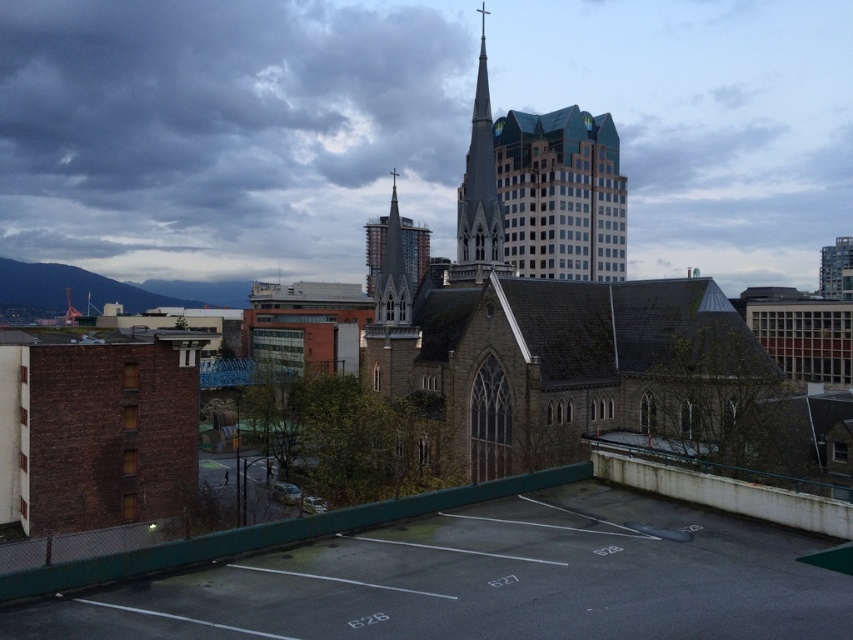
Question: Can you confirm if brown stone church at center is thinner than dark gray stone tower at center?

Choices:
 (A) yes
 (B) no

Answer: (B)

Question: Estimate the real-world distances between objects in this image. Which object is farther from the brown stone church at center?

Choices:
 (A) dark gray stone tower at center
 (B) gray stone spire at center
 (C) brown brick church at left
 (D) dark gray asphalt parking lot at lower center

Answer: (D)

Question: Which of the following is the farthest from the observer?

Choices:
 (A) brown brick church at left
 (B) cloudy sky at upper center
 (C) dark gray stone tower at center

Answer: (B)

Question: Does gray stone spire at center come in front of dark gray stone tower at center?

Choices:
 (A) no
 (B) yes

Answer: (B)

Question: Which of the following is the closest to the observer?

Choices:
 (A) brown stone church at center
 (B) dark gray stone tower at center
 (C) dark gray asphalt parking lot at lower center
 (D) brown brick church at left

Answer: (C)

Question: Does brown brick church at left have a larger size compared to gray stone spire at center?

Choices:
 (A) yes
 (B) no

Answer: (B)